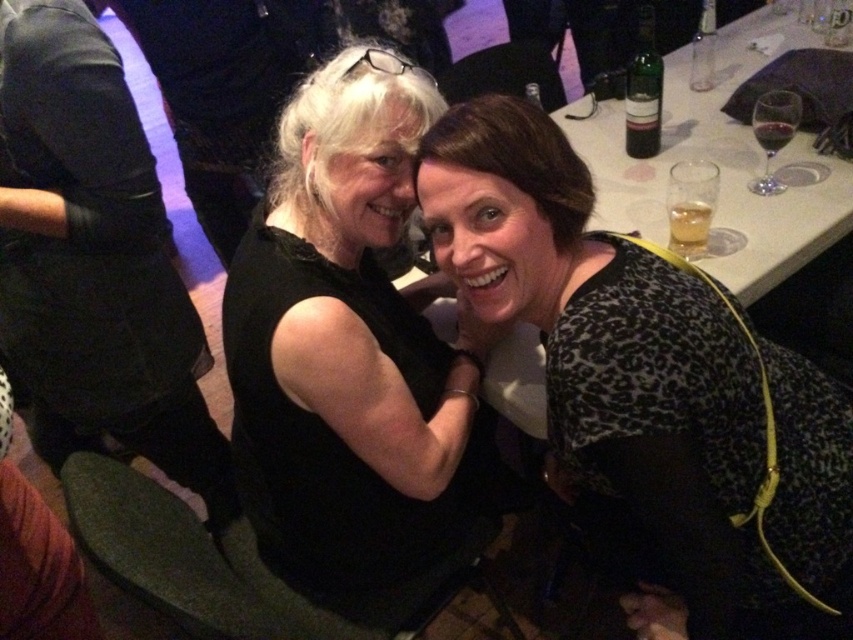
Question: Observing the image, what is the correct spatial positioning of black leopard print dress at center in reference to translucent glass at upper right?

Choices:
 (A) left
 (B) right

Answer: (A)

Question: Estimate the real-world distances between objects in this image. Which object is closer to the translucent glass at upper right?

Choices:
 (A) black leather pants at left
 (B) transparent glass wine glass at upper right
 (C) black matte dress at center
 (D) black leopard print dress at center

Answer: (B)

Question: Observing the image, what is the correct spatial positioning of black matte dress at center in reference to translucent plastic cup at upper right?

Choices:
 (A) above
 (B) below

Answer: (B)

Question: Does black leather pants at left appear on the left side of green glass bottle at upper right?

Choices:
 (A) yes
 (B) no

Answer: (A)

Question: Which point appears closest to the camera in this image?

Choices:
 (A) (732, 401)
 (B) (627, 72)

Answer: (A)

Question: Which point is closer to the camera taking this photo?

Choices:
 (A) (798, 483)
 (B) (341, 556)
 (C) (763, 145)
 (D) (689, 212)

Answer: (A)